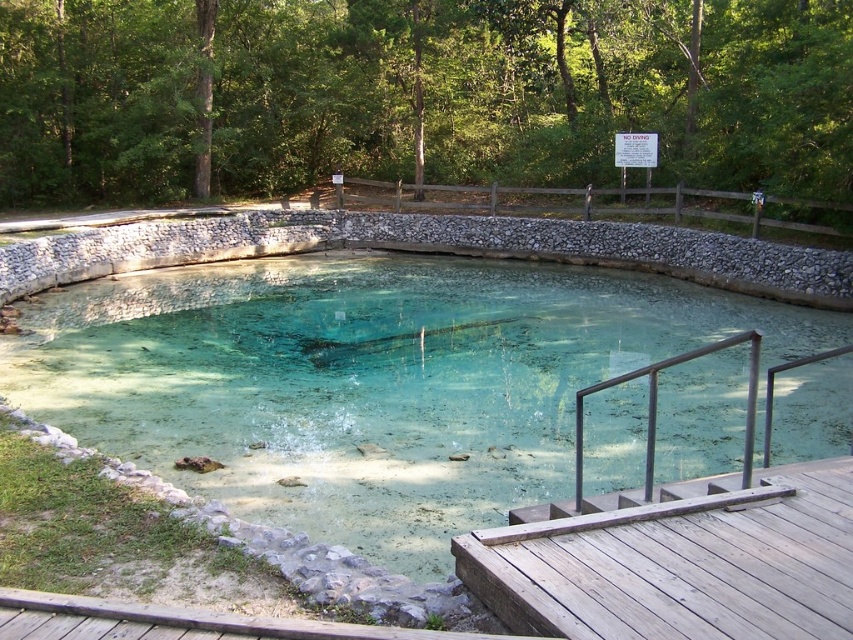
Consider the image. Can you confirm if clear stone pond at center is thinner than brown wooden rail at upper center?

No, clear stone pond at center is not thinner than brown wooden rail at upper center.

Between clear stone pond at center and brown wooden rail at upper center, which one appears on the right side from the viewer's perspective?

From the viewer's perspective, brown wooden rail at upper center appears more on the right side.

Is point (9, 352) farther from viewer compared to point (844, 237)?

That is False.

At what (x,y) coordinates should I click in order to perform the action: click on clear stone pond at center. Please return your answer as a coordinate pair (x, y). The width and height of the screenshot is (853, 640). Looking at the image, I should click on (368, 381).